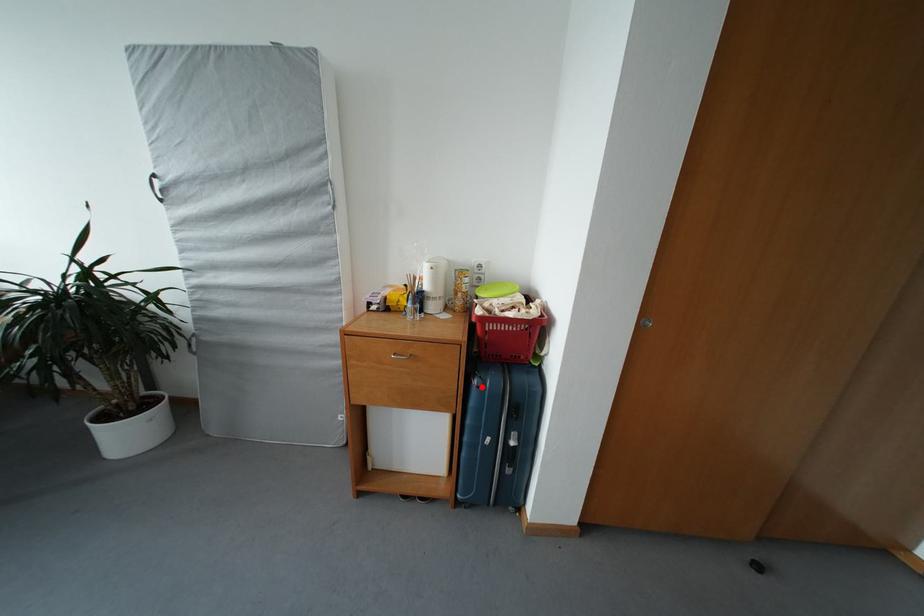
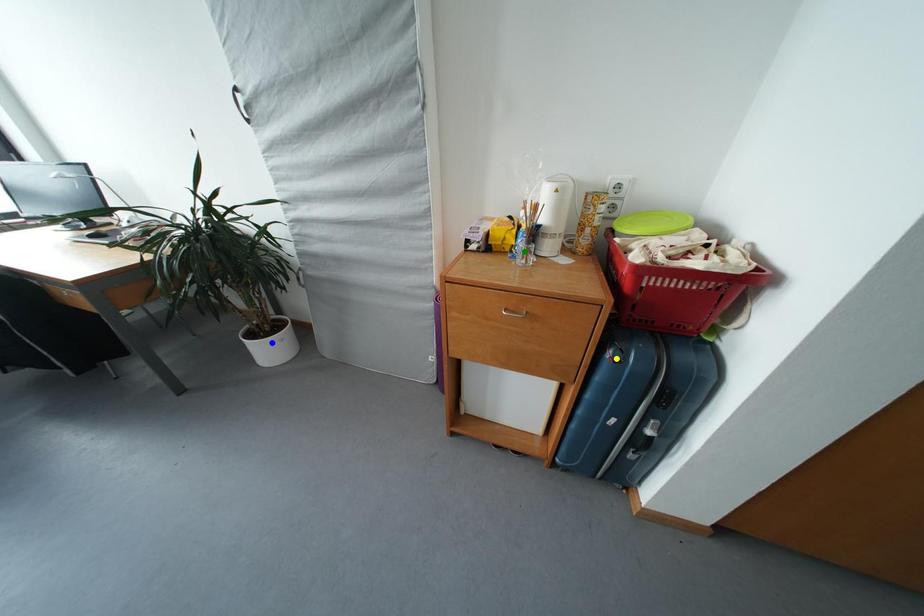
Question: I am providing you with two images of the same scene from different viewpoints. A red point is marked on the first image. You are given multiple points on the second image. In image 2, which mark is for the same physical point as the one in image 1?

Choices:
 (A) blue point
 (B) green point
 (C) yellow point

Answer: (C)